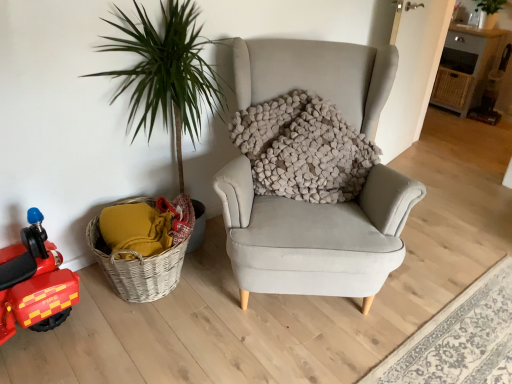
Question: Based on their sizes in the image, would you say shiny red plastic toy car at left is bigger or smaller than woven wood table at upper right?

Choices:
 (A) big
 (B) small

Answer: (B)

Question: From the image's perspective, is shiny red plastic toy car at left above or below woven wood table at upper right?

Choices:
 (A) below
 (B) above

Answer: (A)

Question: Based on their relative distances, which object is nearer to the woven wood table at upper right?

Choices:
 (A) light gray fabric rug at lower right
 (B) shiny red plastic toy car at left

Answer: (A)

Question: Which of these objects is positioned farthest from the shiny red plastic toy car at left?

Choices:
 (A) woven wood table at upper right
 (B) light gray fabric rug at lower right

Answer: (A)